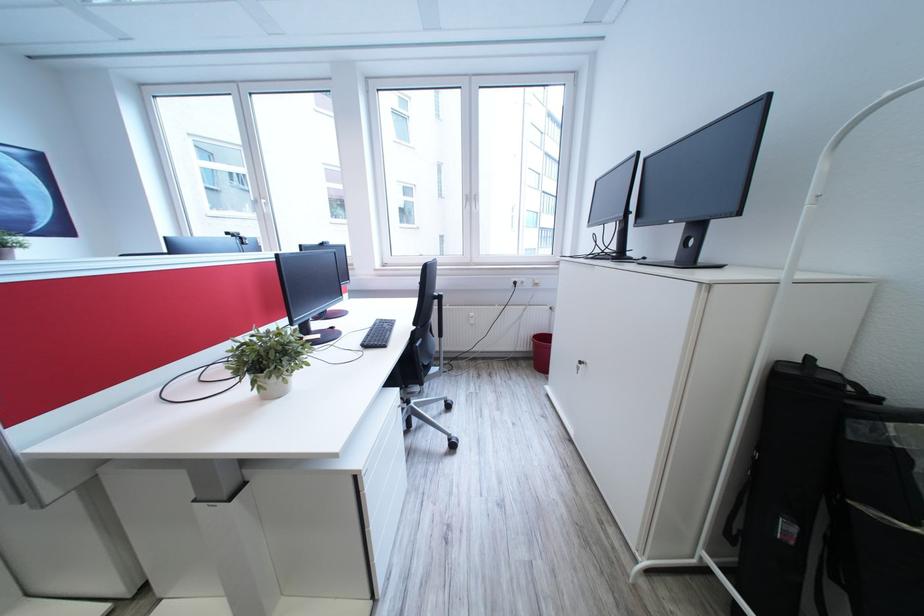
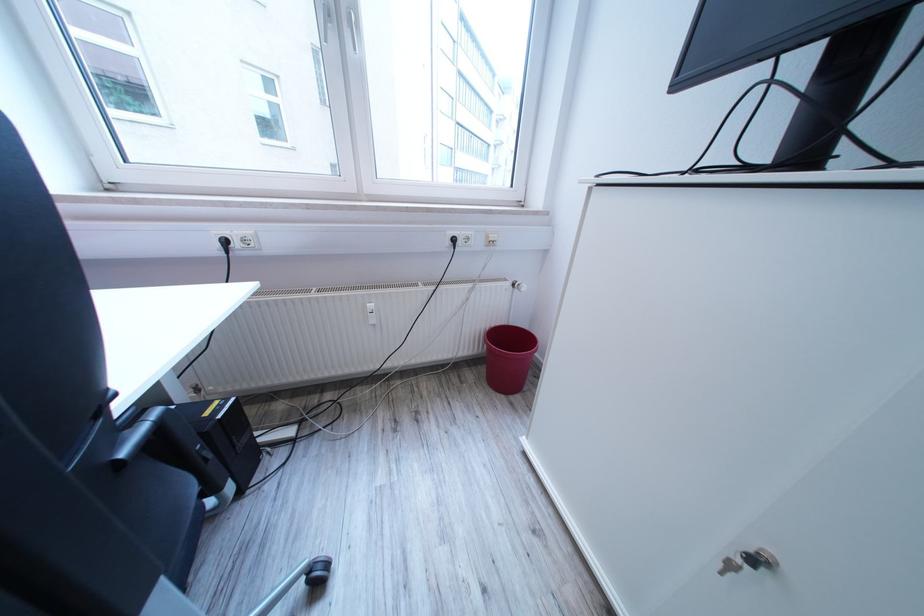
Where in the second image is the point corresponding to point 550,334 from the first image?

(504, 326)